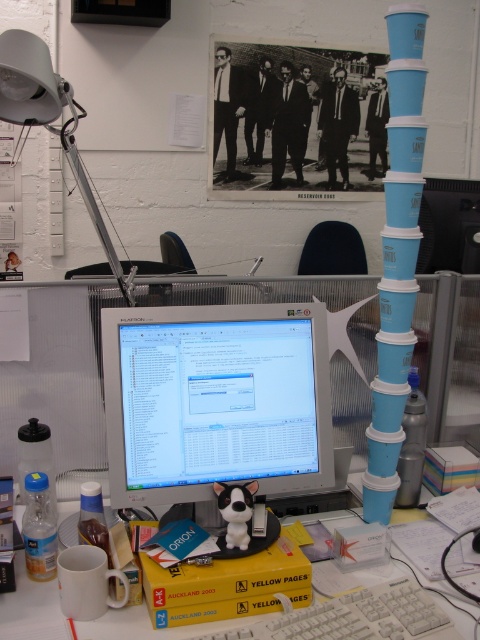
You are working on a project and need to reach for your keyboard. You are currently looking at the matte silver monitor at center. Which direction should you move your hand to reach the white plastic keyboard at center?

The matte silver monitor at center is positioned on the left side of the white plastic keyboard at center, so you should move your hand to the right to reach the white plastic keyboard at center.

You are organizing your desk and want to stack items vertically. Which object, the white plastic keyboard at center or the white plastic computer desk at center, can you place on top of the other without exceeding the desk surface?

The white plastic keyboard at center has a lesser height compared to the white plastic computer desk at center, so you can place the white plastic keyboard at center on top of the white plastic computer desk at center.